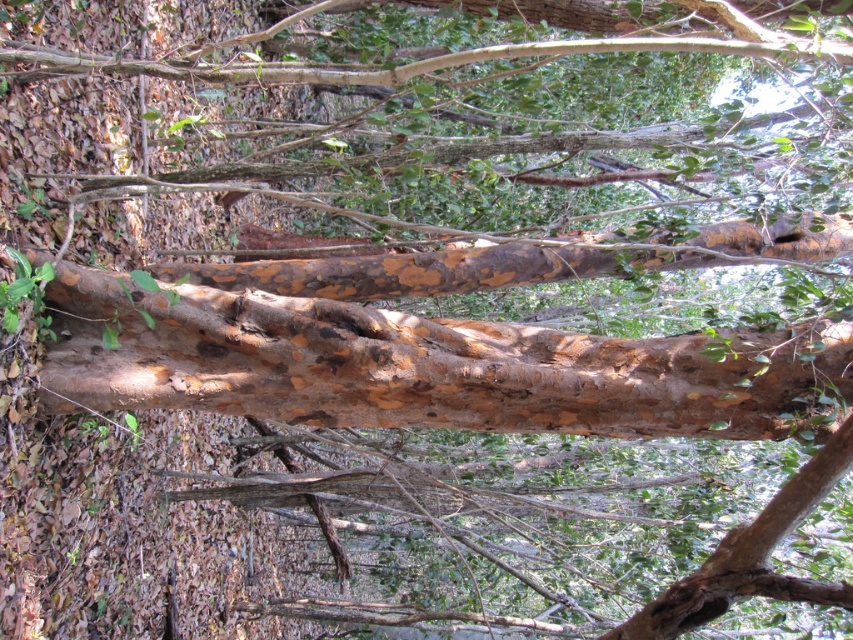
You are standing in a forest and see two points marked on the tree trunk. The first point is at coordinate point(312, 298) and the second is at point(343, 74). Which point is closer to you?

Point(343, 74) is closer to you because it is in front of point(312, 298).